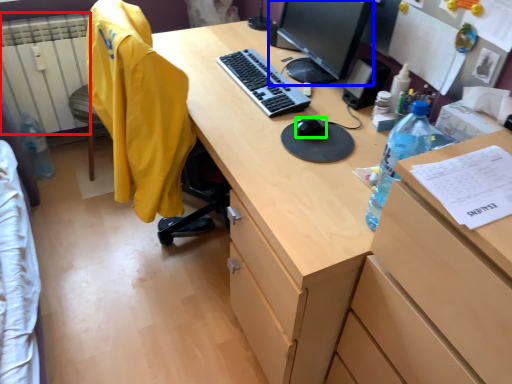
Question: Which object is the closest to the radiator (highlighted by a red box)? Choose among these: television (highlighted by a blue box) or mouse (highlighted by a green box).

Choices:
 (A) television
 (B) mouse

Answer: (A)